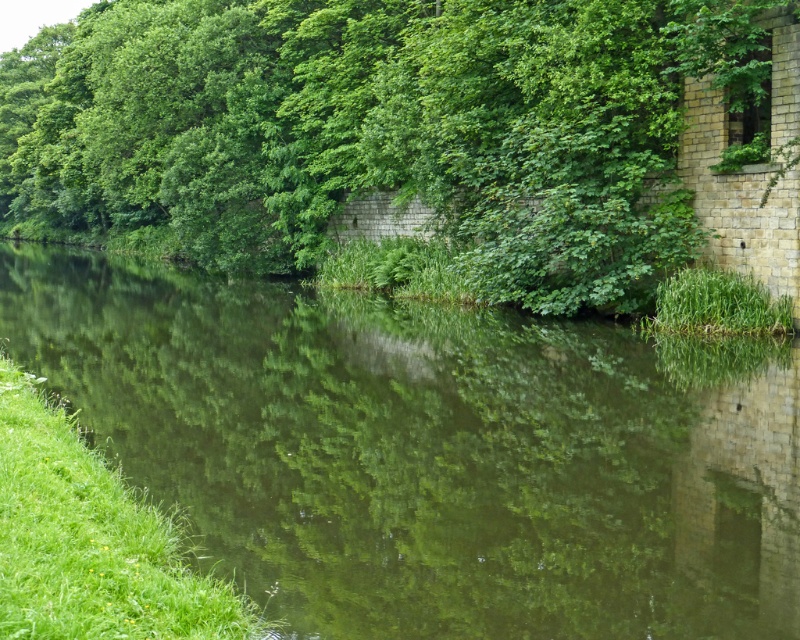
You are standing at the riverside and want to take a photo of both the green reflective water at center and the green leafy tree at upper left. Which object will appear smaller in the photo?

The green reflective water at center will appear smaller in the photo because it has a lesser height compared to the green leafy tree at upper left.

You are standing at the center of the image and want to walk towards the green reflective water at center. Which direction should you move in?

The green reflective water at center is located at point 0.706 on the x axis and 0.540 on the y axis. Since you are at the center, you should move towards the right and slightly downward to reach the green reflective water at center.

You are standing on the riverside bank and want to take a photo of both the green reflective water at center and the green leafy tree at upper left. Which object should you position to the left side of your camera frame to include both in the shot?

To include both the green reflective water at center and the green leafy tree at upper left in your photo, you should position the green leafy tree at upper left on the left side of your camera frame since the green reflective water at center is to its right.